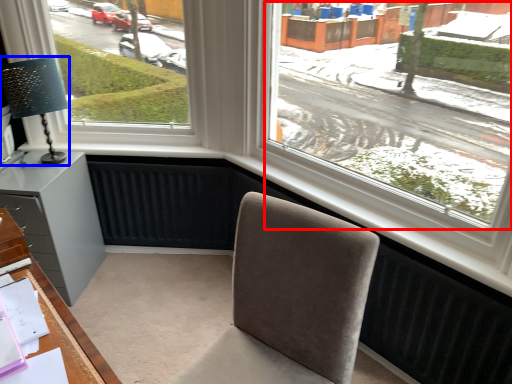
Question: Which object is further to the camera taking this photo, window screen (highlighted by a red box) or table lamp (highlighted by a blue box)?

Choices:
 (A) window screen
 (B) table lamp

Answer: (B)